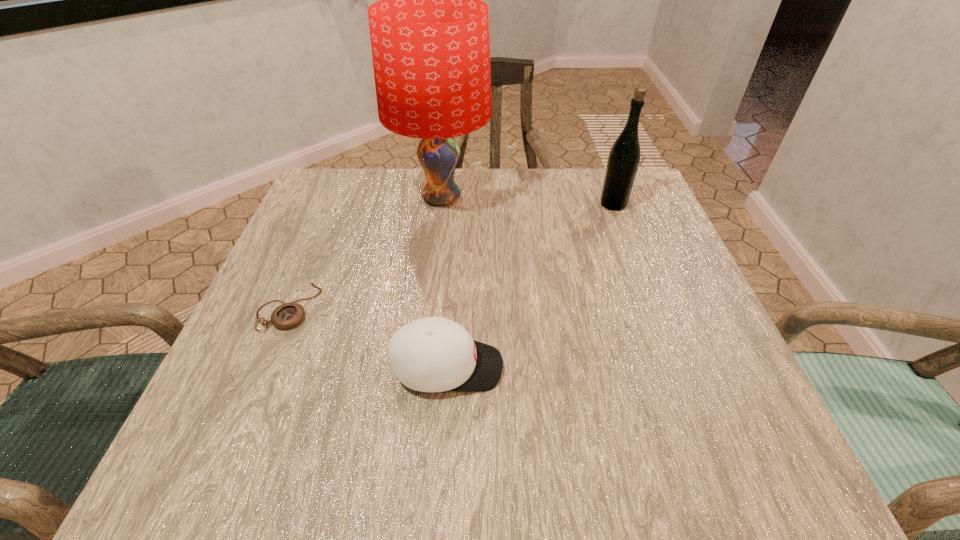
The width and height of the screenshot is (960, 540). I want to click on lampshade, so click(429, 33).

Find the location of a particular element. the third shortest object is located at coordinates (624, 157).

At what (x,y) coordinates should I click in order to perform the action: click on beer bottle. Please return your answer as a coordinate pair (x, y). Looking at the image, I should click on (624, 157).

Locate an element on the screen. The width and height of the screenshot is (960, 540). baseball cap is located at coordinates (433, 354).

I want to click on the third tallest object, so click(x=433, y=354).

The width and height of the screenshot is (960, 540). I want to click on the shortest object, so pos(288,315).

At what (x,y) coordinates should I click in order to perform the action: click on the leftmost object. Please return your answer as a coordinate pair (x, y). This screenshot has height=540, width=960. Looking at the image, I should click on (288, 315).

Find the location of a particular element. Image resolution: width=960 pixels, height=540 pixels. free spot located 0.190m on the front-facing side of the tallest object is located at coordinates (569, 198).

The width and height of the screenshot is (960, 540). Identify the location of free space located on the back of the second tallest object. (602, 174).

Identify the location of vacant space located 0.350m on the front-facing side of the baseball cap. (718, 367).